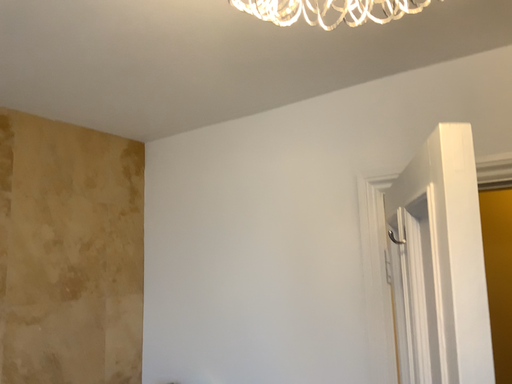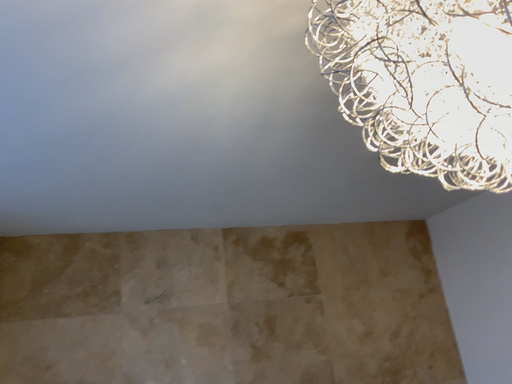
Question: How did the camera likely rotate when shooting the video?

Choices:
 (A) rotated left
 (B) rotated right

Answer: (A)